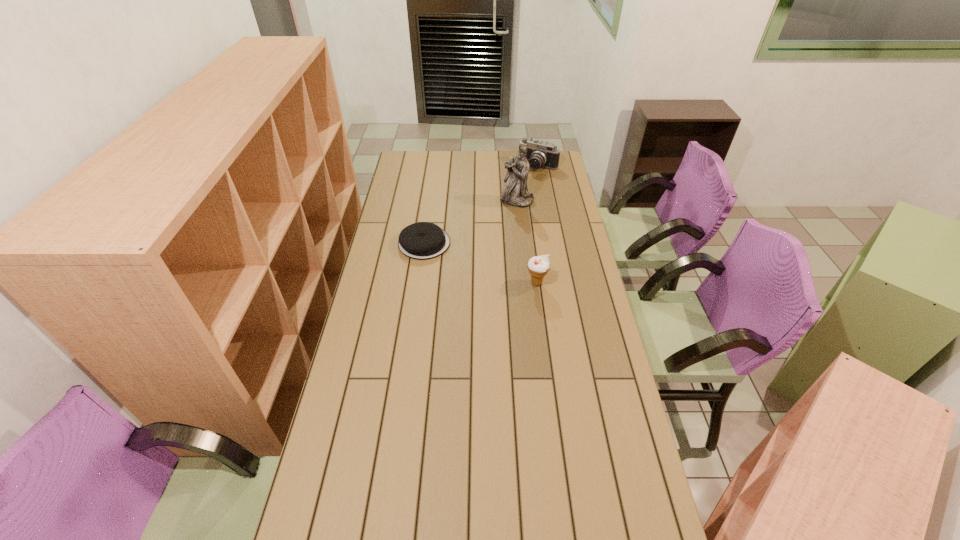
Where is `vacant space situated on the front-facing side of the tallest object`? vacant space situated on the front-facing side of the tallest object is located at coordinates (504, 219).

This screenshot has width=960, height=540. What are the coordinates of `blank space located 0.390m on the front-facing side of the farthest object` in the screenshot? It's located at (504, 214).

At what (x,y) coordinates should I click in order to perform the action: click on vacant space situated 0.260m on the front-facing side of the farthest object. Please return your answer as a coordinate pair (x, y). The height and width of the screenshot is (540, 960). Looking at the image, I should click on click(x=514, y=200).

Where is `vacant region located on the front-facing side of the farthest object`? Image resolution: width=960 pixels, height=540 pixels. vacant region located on the front-facing side of the farthest object is located at coordinates (514, 200).

Find the location of a particular element. object present at the far edge is located at coordinates (539, 154).

Identify the location of object that is at the left edge. The image size is (960, 540). (423, 240).

You are a GUI agent. You are given a task and a screenshot of the screen. Output one action in this format:
    pyautogui.click(x=<x>, y=<y>)
    Task: Click on the object that is at the right edge
    Image resolution: width=960 pixels, height=540 pixels.
    Given the screenshot: What is the action you would take?
    pyautogui.click(x=539, y=154)

I want to click on object that is at the far right corner, so click(x=539, y=154).

Image resolution: width=960 pixels, height=540 pixels. What are the coordinates of `vacant space at the far edge` in the screenshot? It's located at (495, 157).

In the image, there is a desktop. Where is `vacant space at the near edge`? Image resolution: width=960 pixels, height=540 pixels. vacant space at the near edge is located at coordinates (579, 500).